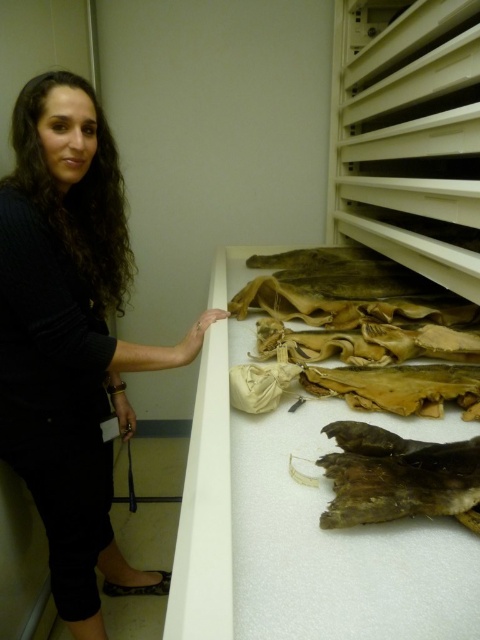
Looking at this image, does brown leather bag at upper right appear on the right side of black sweater at left?

Correct, you'll find brown leather bag at upper right to the right of black sweater at left.

Can you confirm if brown leather bag at upper right is smaller than black sweater at left?

No, brown leather bag at upper right is not smaller than black sweater at left.

Is point (422, 596) farther from camera compared to point (124, 362)?

No.

Locate an element on the screen. brown leather bag at upper right is located at coordinates (302, 529).

Who is more distant from viewer, (78, 509) or (416, 506)?

The point (78, 509) is more distant.

Looking at this image, is black sweater at left positioned before brown leather animal at lower right?

No, black sweater at left is behind brown leather animal at lower right.

Which is behind, point (24, 304) or point (320, 460)?

The point (24, 304) is behind.

Where is `black sweater at left`? The width and height of the screenshot is (480, 640). black sweater at left is located at coordinates (70, 337).

Between brown leather bag at upper right and brown leather animal at lower right, which one is positioned lower?

Positioned lower is brown leather animal at lower right.

Does brown leather bag at upper right appear on the right side of brown leather animal at lower right?

No, brown leather bag at upper right is not to the right of brown leather animal at lower right.

Image resolution: width=480 pixels, height=640 pixels. Describe the element at coordinates (302, 529) in the screenshot. I see `brown leather bag at upper right` at that location.

This screenshot has height=640, width=480. In order to click on brown leather bag at upper right in this screenshot , I will do `click(302, 529)`.